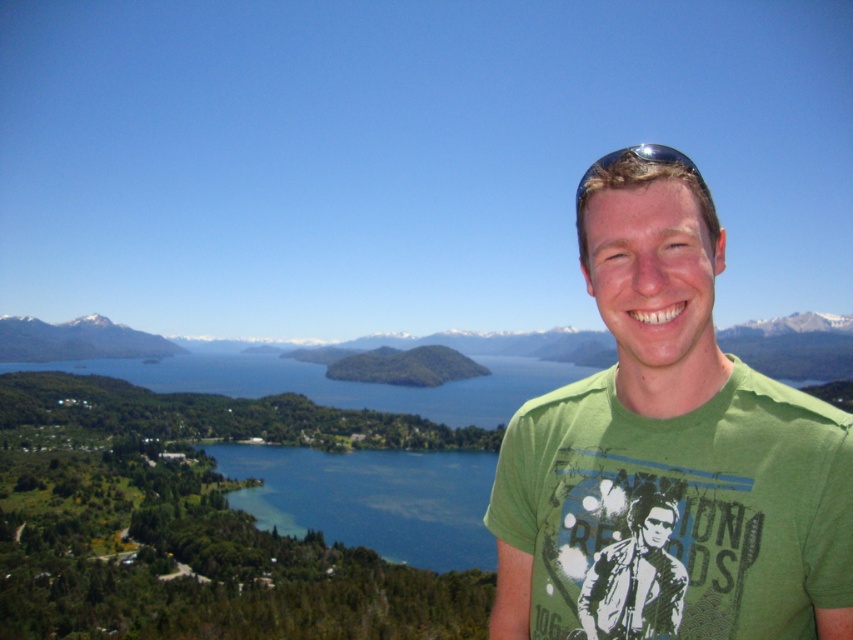
Question: Which object appears closest to the camera in this image?

Choices:
 (A) green printed t-shirt at right
 (B) metallic reflective sunglasses at upper right
 (C) snowy rock mountain at left
 (D) green cotton t-shirt at center

Answer: (D)

Question: Among these points, which one is farthest from the camera?

Choices:
 (A) (682, 598)
 (B) (664, 154)
 (C) (73, 321)
 (D) (608, 294)

Answer: (C)

Question: Observing the image, what is the correct spatial positioning of green printed t-shirt at right in reference to metallic reflective sunglasses at upper right?

Choices:
 (A) below
 (B) above

Answer: (A)

Question: Which object is farther from the camera taking this photo?

Choices:
 (A) green printed t-shirt at right
 (B) metallic reflective sunglasses at upper right
 (C) green cotton t-shirt at center
 (D) snowy rock mountain at left

Answer: (D)

Question: Can you confirm if green cotton t-shirt at center is positioned to the left of metallic reflective sunglasses at upper right?

Choices:
 (A) no
 (B) yes

Answer: (B)

Question: From the image, what is the correct spatial relationship of green printed t-shirt at right in relation to snowy rock mountain at left?

Choices:
 (A) below
 (B) above

Answer: (B)